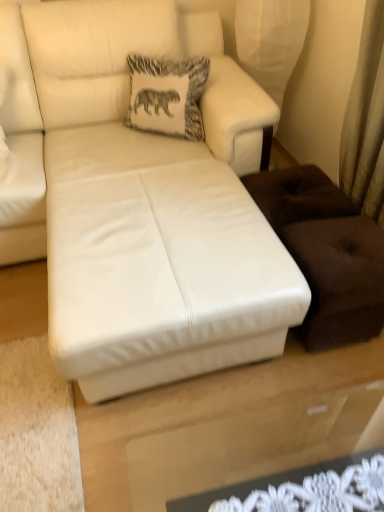
Question: Is point (205, 124) closer or farther from the camera than point (172, 118)?

Choices:
 (A) closer
 (B) farther

Answer: (A)

Question: Is white leather couch at center situated inside white fabric pillow with elephant print at upper center or outside?

Choices:
 (A) inside
 (B) outside

Answer: (B)

Question: Considering the positions of white leather couch at center and white fabric pillow with elephant print at upper center in the image, is white leather couch at center bigger or smaller than white fabric pillow with elephant print at upper center?

Choices:
 (A) big
 (B) small

Answer: (A)

Question: From a real-world perspective, is white fabric pillow with elephant print at upper center above or below white leather couch at center?

Choices:
 (A) above
 (B) below

Answer: (A)

Question: Is white fabric pillow with elephant print at upper center wider or thinner than white leather couch at center?

Choices:
 (A) thin
 (B) wide

Answer: (A)

Question: Relative to white leather couch at center, is white fabric pillow with elephant print at upper center in front or behind?

Choices:
 (A) behind
 (B) front

Answer: (A)

Question: In terms of size, does white fabric pillow with elephant print at upper center appear bigger or smaller than white leather couch at center?

Choices:
 (A) big
 (B) small

Answer: (B)